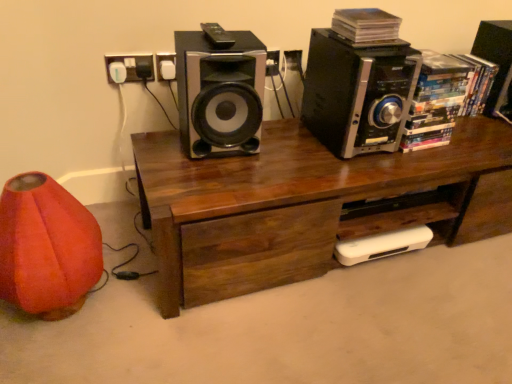
The image size is (512, 384). Identify the location of free space in front of wooden desk at center. (367, 317).